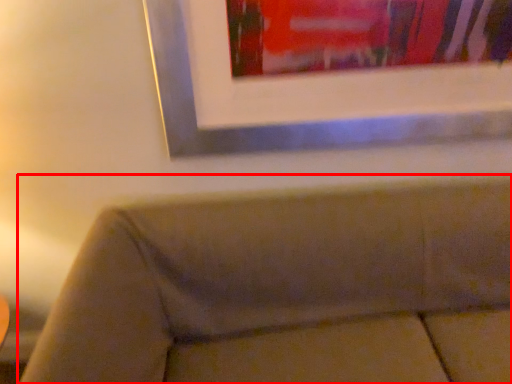
Question: From the image, what is the correct spatial relationship of studio couch (annotated by the red box) in relation to picture frame?

Choices:
 (A) left
 (B) right

Answer: (B)